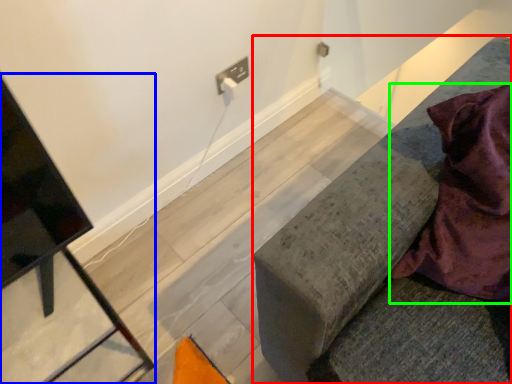
Question: Based on their relative distances, which object is farther from furniture (highlighted by a red box)? Choose from furniture (highlighted by a blue box) and blanket (highlighted by a green box).

Choices:
 (A) furniture
 (B) blanket

Answer: (A)